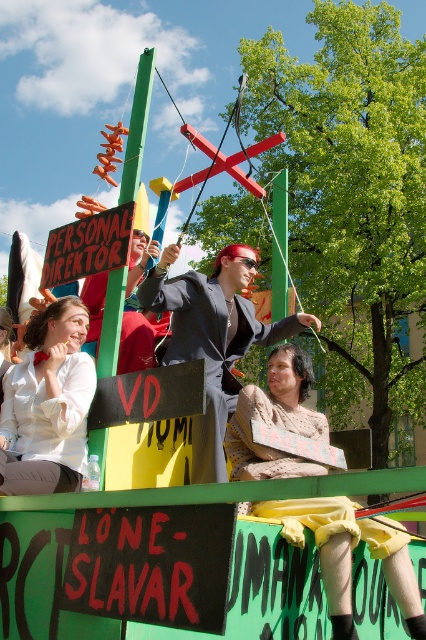
Question: Is white matte shirt at upper left above shiny black suit at center?

Choices:
 (A) no
 (B) yes

Answer: (A)

Question: Does white matte shirt at upper left appear over shiny black suit at center?

Choices:
 (A) no
 (B) yes

Answer: (A)

Question: Which object is farther from the camera taking this photo?

Choices:
 (A) white matte shirt at upper left
 (B) shiny black suit at center

Answer: (A)

Question: Does white matte shirt at upper left have a lesser width compared to shiny black suit at center?

Choices:
 (A) no
 (B) yes

Answer: (B)